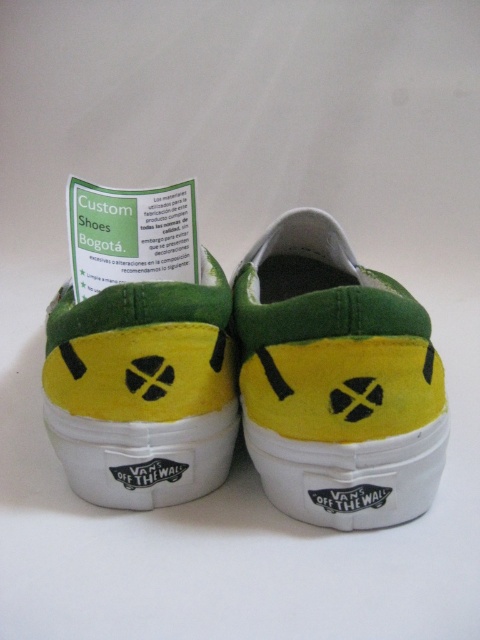
Question: Is green felt shoe at center above yellow suede shoe at center?

Choices:
 (A) no
 (B) yes

Answer: (B)

Question: Which point appears farthest from the camera in this image?

Choices:
 (A) (85, 352)
 (B) (327, 422)

Answer: (A)

Question: Is green felt shoe at center to the left of yellow suede shoe at center from the viewer's perspective?

Choices:
 (A) yes
 (B) no

Answer: (B)

Question: Is green felt shoe at center bigger than yellow suede shoe at center?

Choices:
 (A) yes
 (B) no

Answer: (A)

Question: Which of the following is the closest to the observer?

Choices:
 (A) green felt shoe at center
 (B) yellow suede shoe at center

Answer: (A)